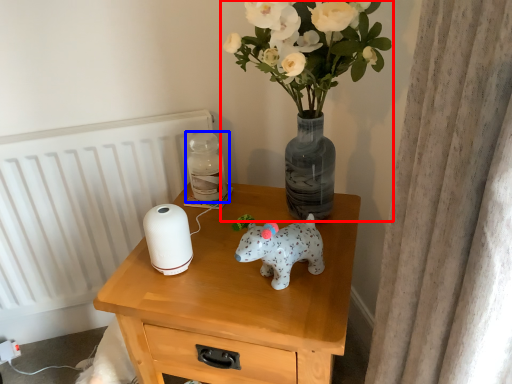
Question: Which object appears closest to the camera in this image, houseplant (highlighted by a red box) or bottle (highlighted by a blue box)?

Choices:
 (A) houseplant
 (B) bottle

Answer: (A)